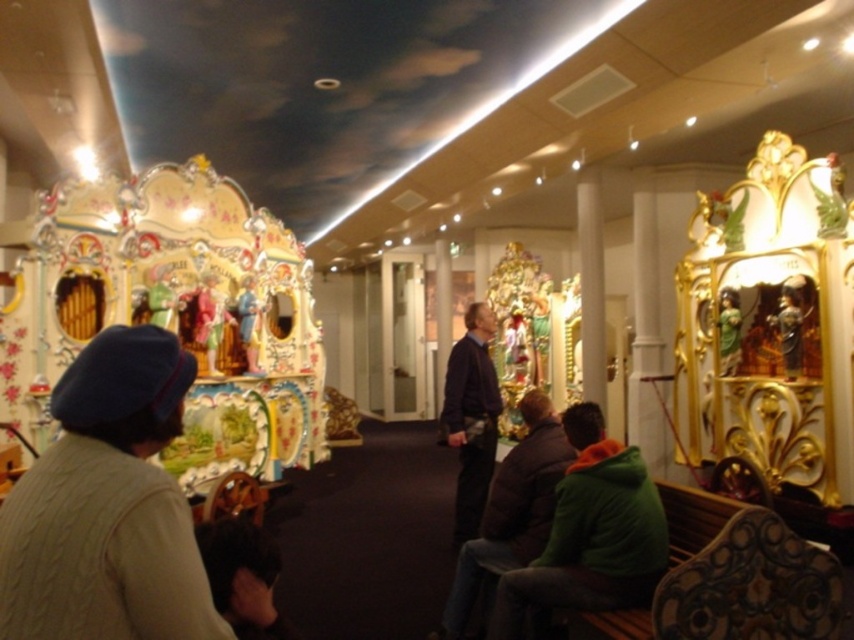
You are standing in the museum and want to take a photo of the carousel. The camera you are using has a focal length of 50mm and a sensor size of 24mm x 36mm. The point you want to focus on is at coordinate point (145, 440). What is the minimum distance you need to be from the carousel to ensure the entire carousel fits in the frame?

The point at (145, 440) is 1.29 meters away from the camera. To ensure the entire carousel fits in the frame, you need to be at least 1.29 meters away from the carousel.